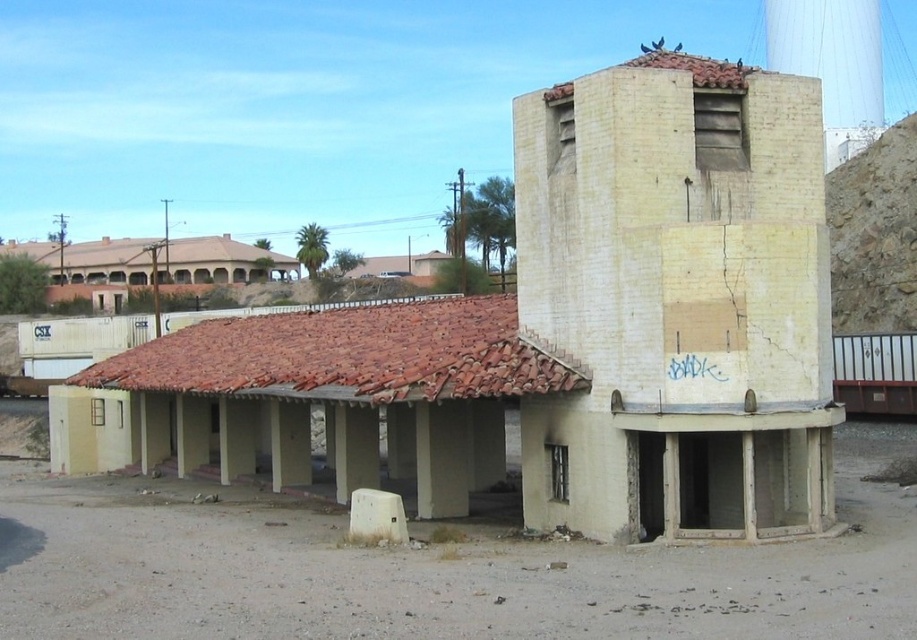
You are a drone operator tasked with inspecting two structures in a desert area. You have a drone with a maximum flight range of 25 meters. You need to fly from the yellowish concrete tower at upper right to the white concrete water tower at upper center. Can your drone complete this flight without needing a recharge?

The yellowish concrete tower at upper right and the white concrete water tower at upper center are 26.62 meters apart. Since the drone has a maximum flight range of 25 meters, it cannot complete the flight without needing a recharge.

You are a drone operator trying to navigate between two landmarks in the desert. You see the yellowish concrete tower at upper right and the white concrete water tower at upper center. Which one is positioned more to the left side of the image?

The yellowish concrete tower at upper right is positioned to the left of the white concrete water tower at upper center, so the yellowish concrete tower at upper right is more to the left.